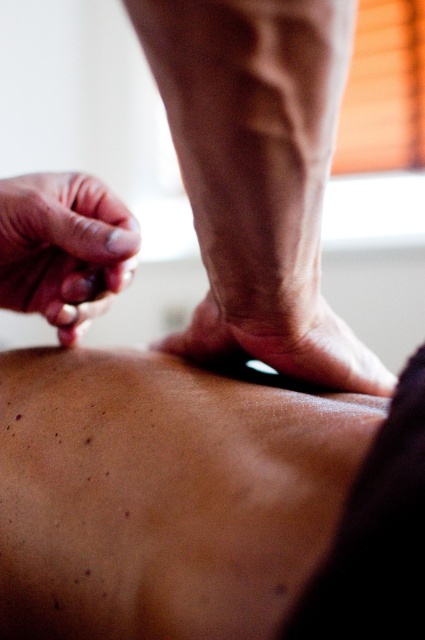
Question: From the image, what is the correct spatial relationship of smooth skin at center in relation to dry skin at center?

Choices:
 (A) right
 (B) left

Answer: (B)

Question: Does smooth skin at center have a lesser width compared to smooth skin hand at upper left?

Choices:
 (A) no
 (B) yes

Answer: (A)

Question: Does smooth skin leg at center have a smaller size compared to smooth skin hand at upper left?

Choices:
 (A) yes
 (B) no

Answer: (B)

Question: Which object appears farthest from the camera in this image?

Choices:
 (A) smooth skin leg at center
 (B) smooth skin at center
 (C) smooth skin hand at upper left
 (D) dry skin at center

Answer: (C)

Question: Estimate the real-world distances between objects in this image. Which object is farther from the smooth skin hand at upper left?

Choices:
 (A) smooth skin at center
 (B) smooth skin leg at center
 (C) dry skin at center

Answer: (A)

Question: Among these points, which one is nearest to the camera?

Choices:
 (A) (288, 532)
 (B) (73, 307)
 (C) (218, 337)

Answer: (A)